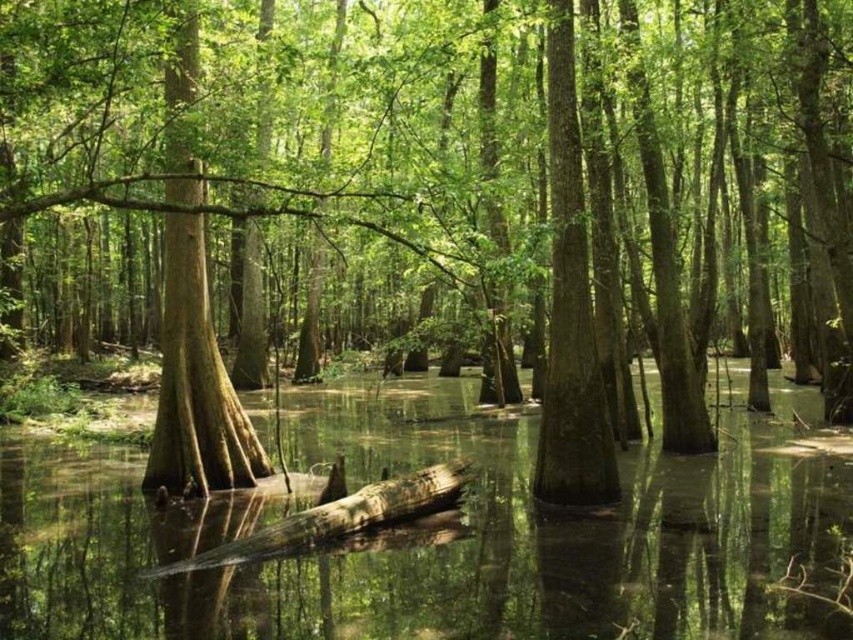
Question: Does clear water at center appear over brown rough log at center?

Choices:
 (A) yes
 (B) no

Answer: (B)

Question: Which is farther from the brown rough log at center?

Choices:
 (A) green rough bark tree trunk at center
 (B) smooth brown tree trunk at center
 (C) clear water at center

Answer: (A)

Question: Which object appears farthest from the camera in this image?

Choices:
 (A) clear water at center
 (B) green rough bark tree trunk at center
 (C) smooth brown tree trunk at center

Answer: (C)

Question: Which point is closer to the camera?

Choices:
 (A) green rough bark tree trunk at center
 (B) brown rough log at center

Answer: (A)

Question: Is clear water at center bigger than green rough bark tree trunk at center?

Choices:
 (A) yes
 (B) no

Answer: (A)

Question: Can you confirm if clear water at center is positioned above green rough bark tree trunk at center?

Choices:
 (A) yes
 (B) no

Answer: (B)